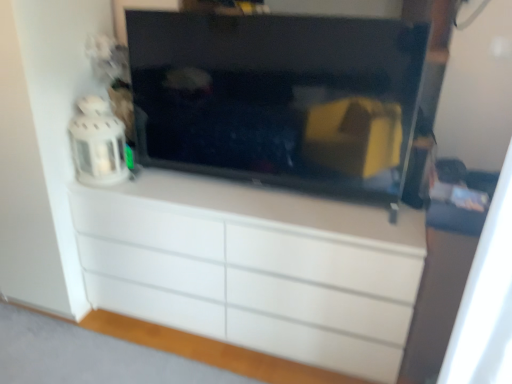
Image resolution: width=512 pixels, height=384 pixels. What are the coordinates of `free space above black glossy tv at center (from a real-world perspective)` in the screenshot? It's located at (201, 7).